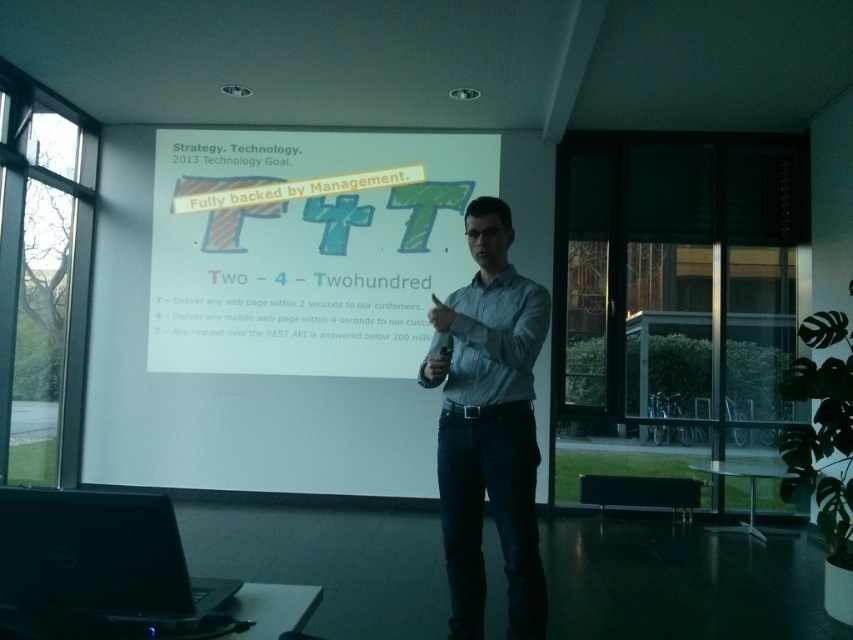
You are sitting in the front row of the presentation. Which object is closer to you, the white matte projection screen at center or the denim jeans at center?

→ The white matte projection screen at center is closer to you than the denim jeans at center because it is further to the viewer.

You are a photographer positioned at the camera location. You want to capture a closeup shot of the point marked at coordinates (405,333) on the projection screen. Given that your camera has a minimum focus distance of 6 meters, will you be able to focus on that point?

The point marked at coordinates (405,333) is 5.99 meters away from the camera. Since the minimum focus distance of the camera is 6 meters, the camera cannot focus on the point because it is slightly closer than the required distance.